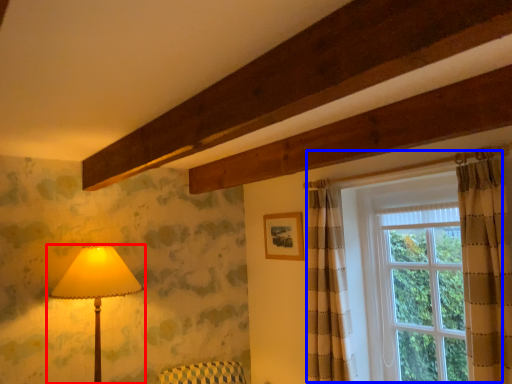
Question: Which of the following is the farthest to the observer, lamp (highlighted by a red box) or window (highlighted by a blue box)?

Choices:
 (A) lamp
 (B) window

Answer: (A)